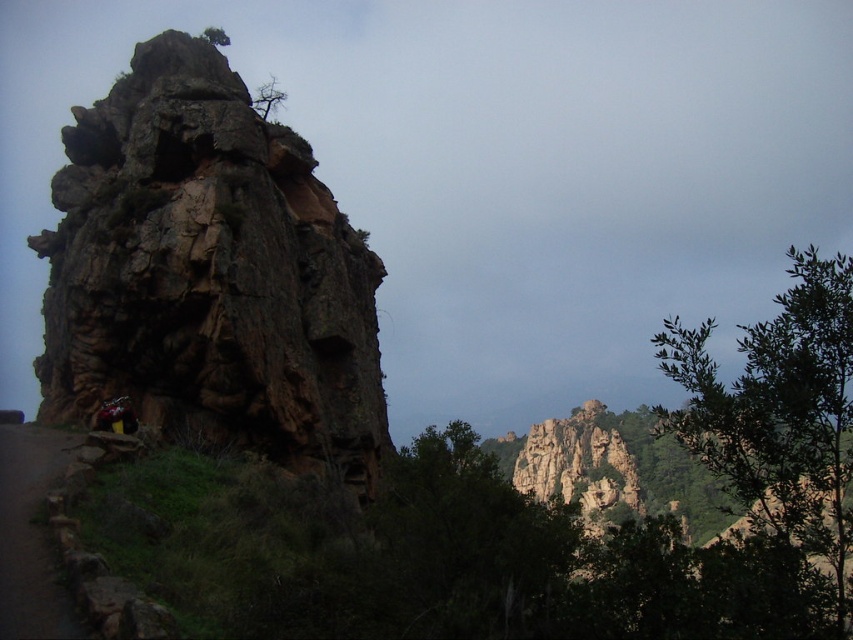
Question: Can you confirm if green leafy tree at right is positioned to the right of green leafy tree at center?

Choices:
 (A) yes
 (B) no

Answer: (A)

Question: Can you confirm if green leafy tree at right is smaller than bare branches at upper center?

Choices:
 (A) yes
 (B) no

Answer: (B)

Question: Which of the following is the closest to the observer?

Choices:
 (A) pos(550,524)
 (B) pos(263,83)
 (C) pos(107,378)
 (D) pos(38,476)

Answer: (A)

Question: Can you confirm if green leafy tree at right is smaller than green leafy tree at center?

Choices:
 (A) no
 (B) yes

Answer: (A)

Question: Which point is closer to the camera?

Choices:
 (A) (265, 90)
 (B) (32, 627)

Answer: (B)

Question: Which point is farther to the camera?

Choices:
 (A) (769, 477)
 (B) (264, 92)
 (C) (271, 371)

Answer: (B)